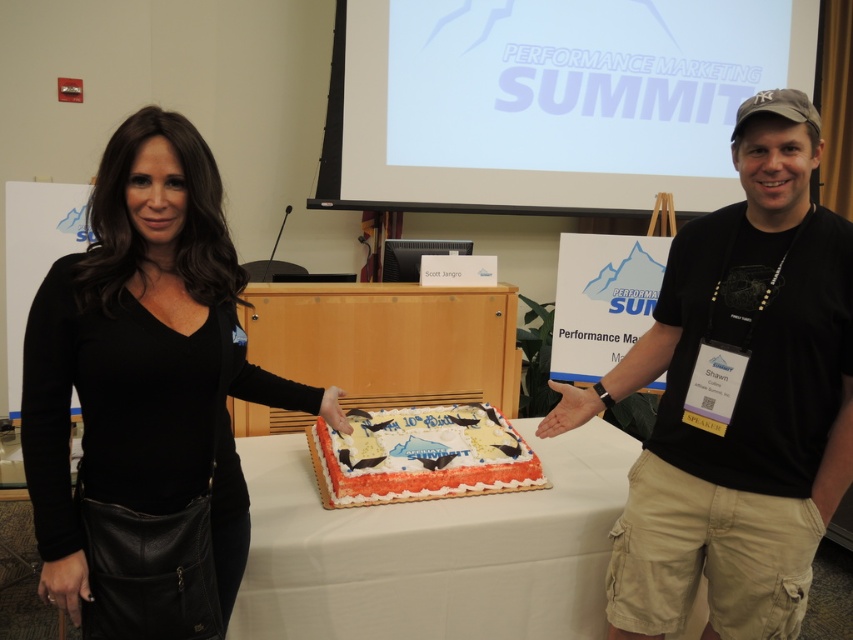
Does black t-shirt at center have a lesser width compared to white frosted cake at center?

Correct, black t-shirt at center's width is less than white frosted cake at center's.

Measure the distance between black t-shirt at center and white frosted cake at center.

black t-shirt at center and white frosted cake at center are 19.33 inches apart from each other.

You are a GUI agent. You are given a task and a screenshot of the screen. Output one action in this format:
    pyautogui.click(x=<x>, y=<y>)
    Task: Click on the black t-shirt at center
    The height and width of the screenshot is (640, 853).
    Given the screenshot: What is the action you would take?
    pyautogui.click(x=737, y=397)

In order to click on black t-shirt at center in this screenshot , I will do `click(737, 397)`.

Is white paper table at center above white frosted cake at center?

Incorrect, white paper table at center is not positioned above white frosted cake at center.

Does point (291, 435) come closer to viewer compared to point (372, 436)?

No, (291, 435) is further to viewer.

Locate an element on the screen. The image size is (853, 640). white paper table at center is located at coordinates (433, 548).

Who is taller, black leather jacket at center or black t-shirt at center?

black t-shirt at center is taller.

Between black leather jacket at center and black t-shirt at center, which one has less height?

black leather jacket at center

Where is `black leather jacket at center`? This screenshot has height=640, width=853. black leather jacket at center is located at coordinates (146, 397).

I want to click on black leather jacket at center, so point(146,397).